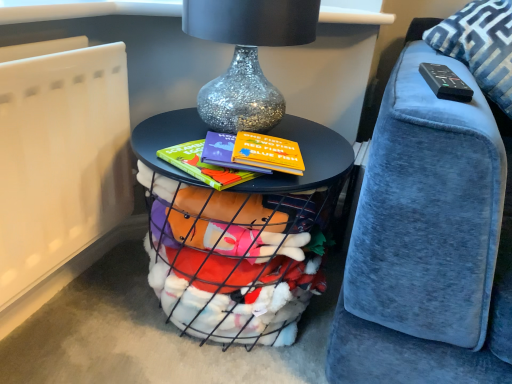
Question: Is metallic wire basket at center taller or shorter than white matte radiator at lower left?

Choices:
 (A) tall
 (B) short

Answer: (B)

Question: Considering their positions, is metallic wire basket at center located in front of or behind white matte radiator at lower left?

Choices:
 (A) front
 (B) behind

Answer: (B)

Question: Estimate the real-world distances between objects in this image. Which object is farther from the metallic wire basket at center?

Choices:
 (A) white matte radiator at lower left
 (B) black plastic remote at upper right
 (C) blue velvet pillow at upper right
 (D) glittery silver glass table lamp at center

Answer: (C)

Question: Which of these objects is positioned closest to the metallic wire basket at center?

Choices:
 (A) blue velvet pillow at upper right
 (B) white matte radiator at lower left
 (C) black plastic remote at upper right
 (D) glittery silver glass table lamp at center

Answer: (D)